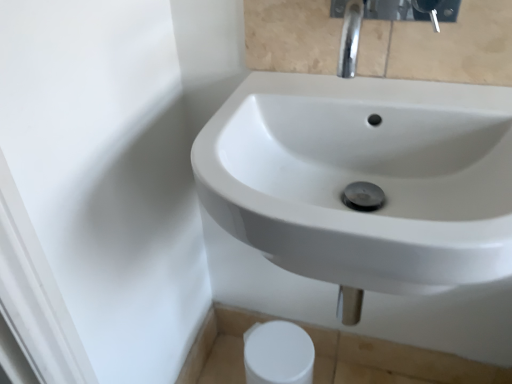
Question: Would you say white glossy sink at center is inside or outside white matte toilet paper at lower center?

Choices:
 (A) outside
 (B) inside

Answer: (A)

Question: Considering their positions, is white glossy sink at center located in front of or behind white matte toilet paper at lower center?

Choices:
 (A) behind
 (B) front

Answer: (B)

Question: Considering the real-world distances, which object is farthest from the white matte toilet paper at lower center?

Choices:
 (A) chrome metallic faucet at upper center
 (B) white glossy sink at center

Answer: (A)

Question: Based on their relative distances, which object is farther from the white glossy sink at center?

Choices:
 (A) white matte toilet paper at lower center
 (B) chrome metallic faucet at upper center

Answer: (A)